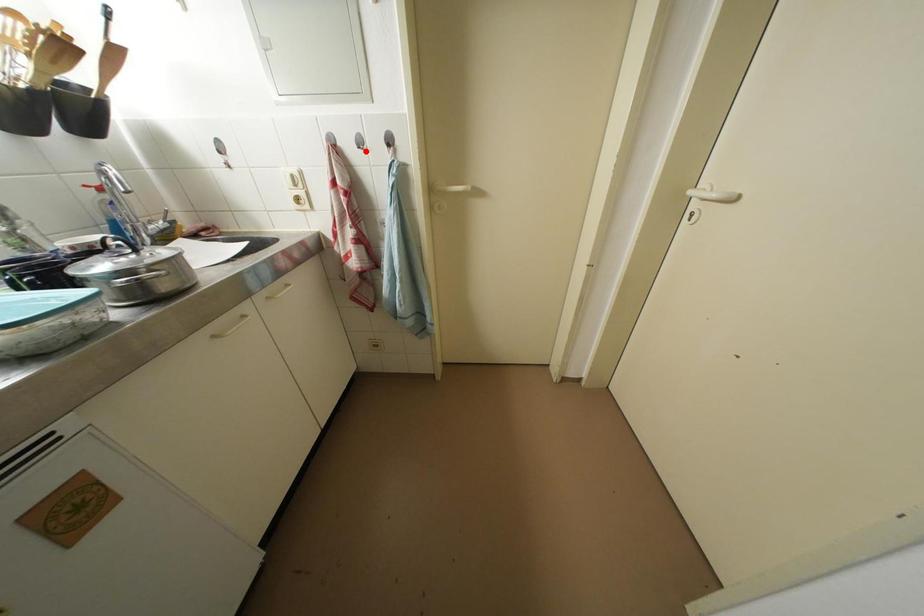
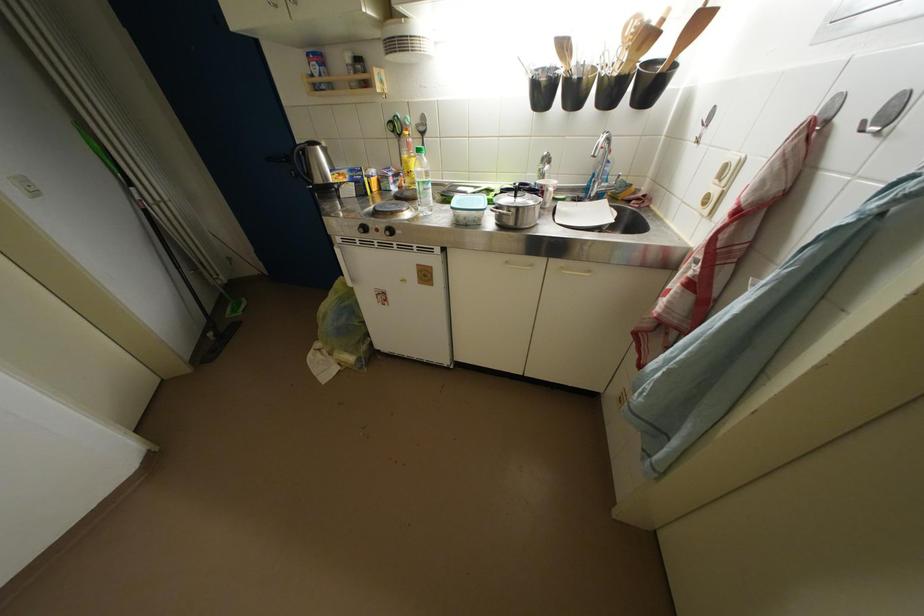
Find the pixel in the second image that matches the highlighted location in the first image.

(869, 132)